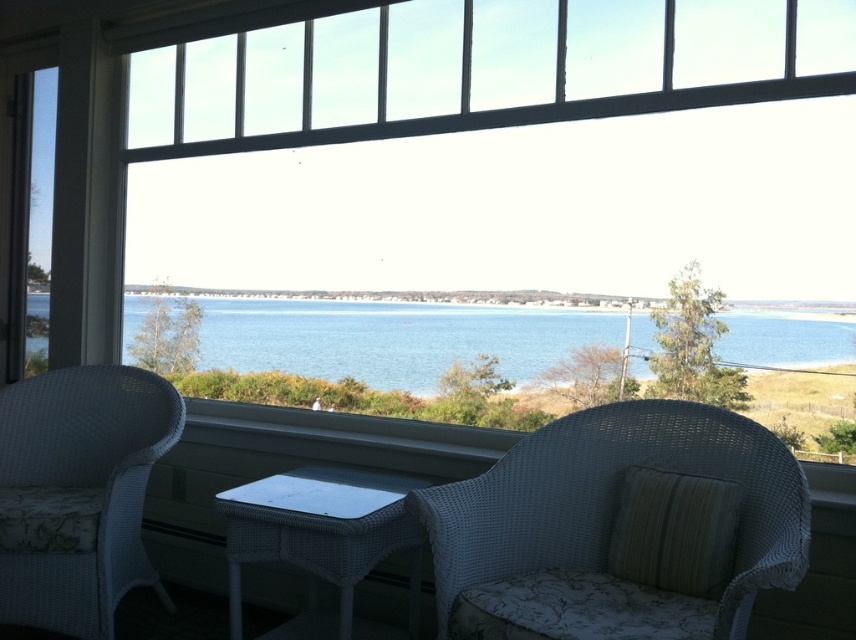
Which of these two, white wicker armchair at center or blue water at center, stands taller?

white wicker armchair at center is taller.

Is white wicker armchair at center thinner than blue water at center?

Yes.

Who is more distant from viewer, (801, 513) or (819, 346)?

Positioned behind is point (819, 346).

This screenshot has width=856, height=640. I want to click on white wicker armchair at center, so click(x=614, y=499).

This screenshot has height=640, width=856. Describe the element at coordinates (393, 337) in the screenshot. I see `blue water at center` at that location.

Is point (730, 344) closer to viewer compared to point (229, 534)?

No, (730, 344) is further to viewer.

Who is more forward, [738,348] or [310,472]?

Point [738,348] is in front.

What are the coordinates of `blue water at center` in the screenshot? It's located at (393, 337).

Which is below, white wicker armchair at center or white wicker armchair at left?

Positioned lower is white wicker armchair at left.

Describe the element at coordinates (614, 499) in the screenshot. I see `white wicker armchair at center` at that location.

The width and height of the screenshot is (856, 640). I want to click on white wicker armchair at center, so click(x=614, y=499).